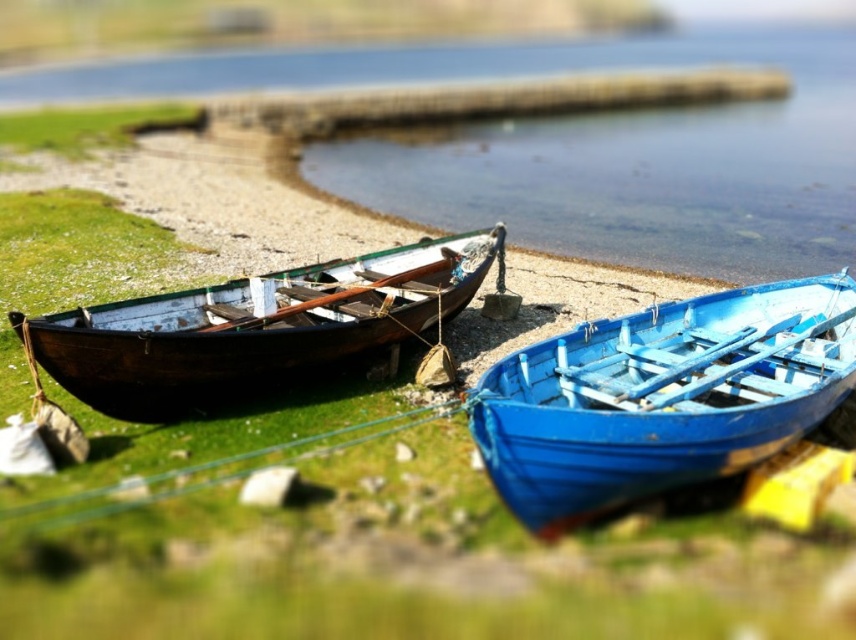
You are standing at the shore looking at the two boats. You want to pick up an object that is closer to you. Which point should you go to, point (670, 326) or point (199, 348)?

Point (199, 348) is closer to you than point (670, 326), so you should go to point (199, 348).

You are standing at the origin point of the coordinate system in the image. You want to walk towards the blue matte boat at lower right. In which direction should you move first? Please provide your answer in terms of the coordinate system axes. The coordinate system has the origin at the bottom left corner of the image, with the x axis pointing to the right and the y axis pointing upwards.

The blue matte boat at lower right is located at coordinate point 0.620 on the x axis and 0.775 on the y axis. Since you are at the origin point, which is the bottom left corner, moving towards the right along the x axis and slightly upwards along the y axis will lead you to the boat.